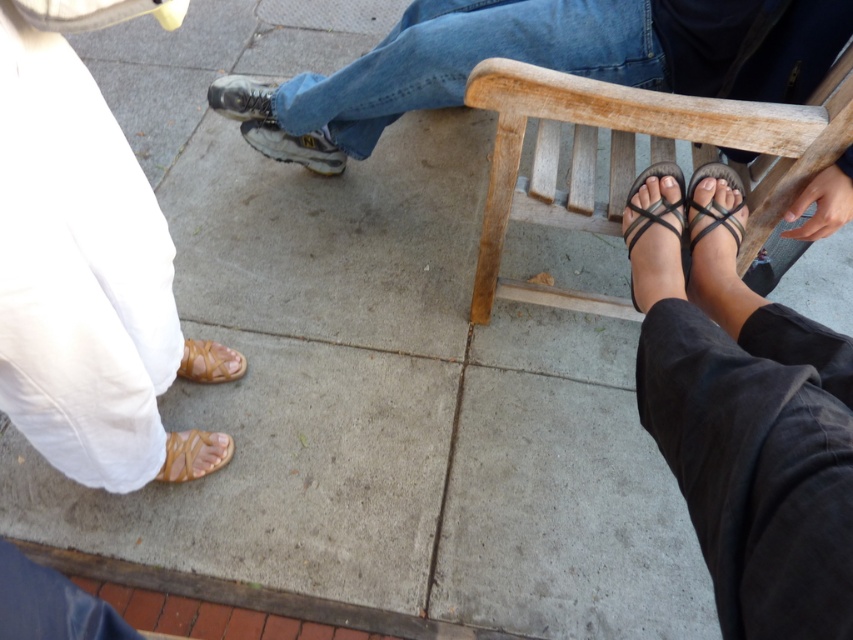
Question: Among these points, which one is nearest to the camera?

Choices:
 (A) (834, 531)
 (B) (451, 42)
 (C) (225, 460)

Answer: (A)

Question: Is leather shoe at center smaller than tan leather sandal at lower left?

Choices:
 (A) yes
 (B) no

Answer: (B)

Question: Which point is farther to the camera?

Choices:
 (A) (270, 122)
 (B) (822, 397)
 (C) (136, 486)

Answer: (A)

Question: Estimate the real-world distances between objects in this image. Which object is farther from the leather textured shoe at center?

Choices:
 (A) matte white pants at lower left
 (B) denim jeans at upper center
 (C) brown woven sandal at lower right

Answer: (C)

Question: Is black woven sandal at lower right smaller than tan woven sandal at lower left?

Choices:
 (A) yes
 (B) no

Answer: (B)

Question: Observing the image, what is the correct spatial positioning of denim jeans at upper center in reference to leather shoe at center?

Choices:
 (A) above
 (B) below

Answer: (B)